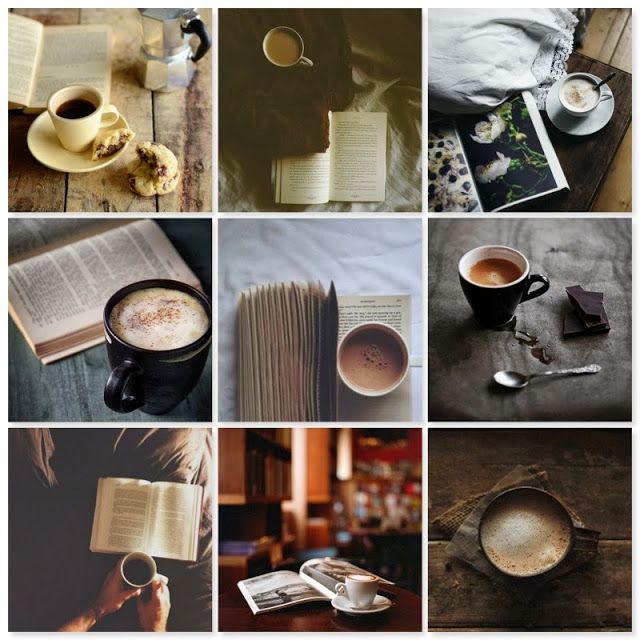
Image resolution: width=640 pixels, height=640 pixels. I want to click on cups, so click(147, 570), click(355, 586), click(505, 550), click(162, 372), click(372, 369), click(486, 301), click(580, 112), click(274, 56), click(89, 122).